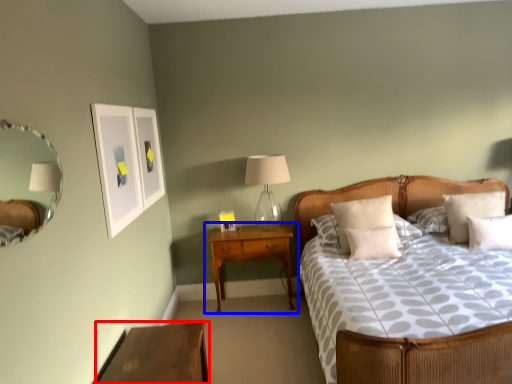
Question: Which object is closer to the camera taking this photo, nightstand (highlighted by a red box) or nightstand (highlighted by a blue box)?

Choices:
 (A) nightstand
 (B) nightstand

Answer: (A)